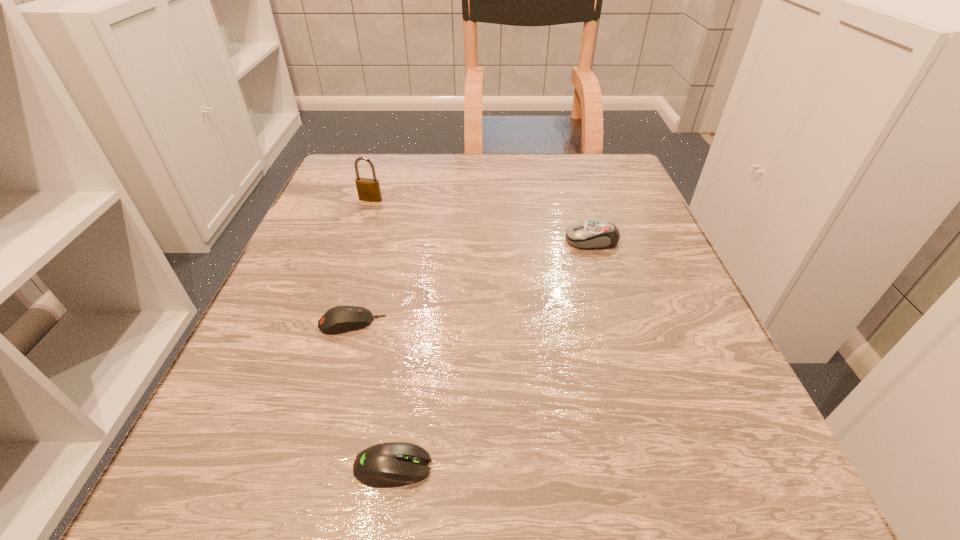
Image resolution: width=960 pixels, height=540 pixels. I want to click on vacant space at the far edge of the desktop, so click(434, 181).

Locate an element on the screen. vacant region at the near edge of the desktop is located at coordinates click(510, 493).

Where is `vacant space at the left edge`? vacant space at the left edge is located at coordinates (324, 295).

I want to click on vacant space at the right edge of the desktop, so click(587, 221).

Where is `free region at the far left corner of the desktop`? Image resolution: width=960 pixels, height=540 pixels. free region at the far left corner of the desktop is located at coordinates (386, 170).

The width and height of the screenshot is (960, 540). I want to click on vacant area at the near left corner of the desktop, so click(x=201, y=476).

The height and width of the screenshot is (540, 960). In the image, there is a desktop. Identify the location of vacant space at the far right corner. (573, 186).

Where is `free space at the near right corner of the desktop`? free space at the near right corner of the desktop is located at coordinates (717, 470).

The width and height of the screenshot is (960, 540). Find the location of `free point between the nearest computer mouse and the second farthest object`. free point between the nearest computer mouse and the second farthest object is located at coordinates (492, 354).

At what (x,y) coordinates should I click in order to perform the action: click on vacant space in between the second tallest object and the nearest computer mouse. Please return your answer as a coordinate pair (x, y). Image resolution: width=960 pixels, height=540 pixels. Looking at the image, I should click on (492, 354).